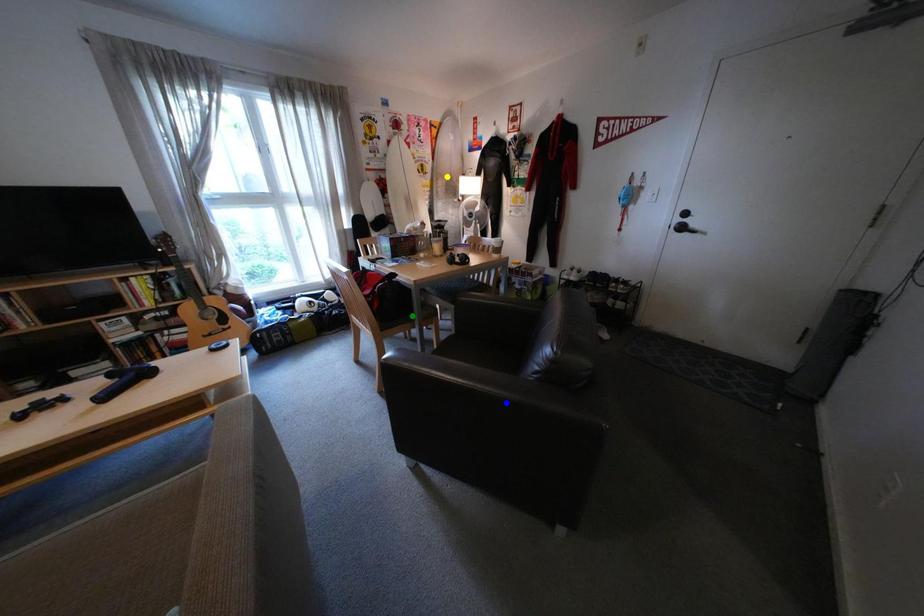
Order these from nearest to farthest:
green point
blue point
yellow point

blue point, green point, yellow point